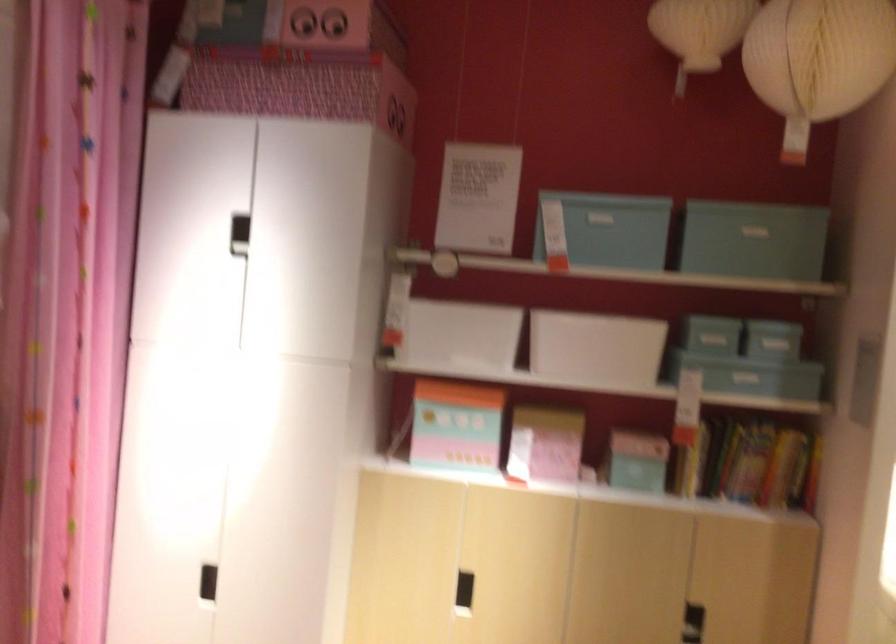
The location [455,426] corresponds to which object?

It corresponds to the pink box in the image.